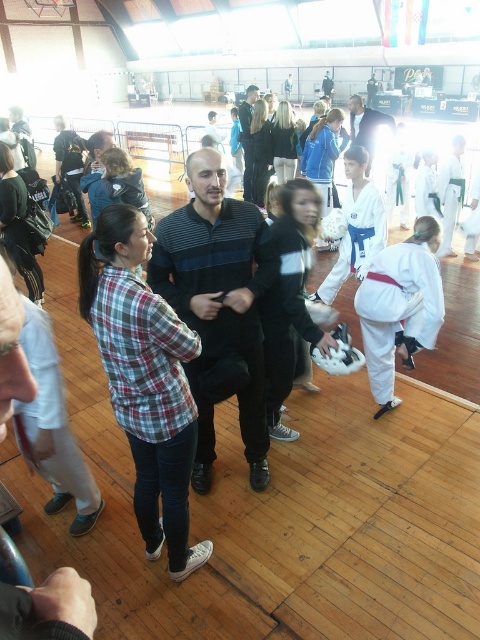
Question: Can you confirm if striped sweater at center is wider than matte black jacket at center?

Choices:
 (A) yes
 (B) no

Answer: (B)

Question: Can you confirm if striped sweater at center is positioned to the left of dark blue striped sweater at center?

Choices:
 (A) yes
 (B) no

Answer: (A)

Question: Can you confirm if striped sweater at center is positioned below dark blue striped sweater at center?

Choices:
 (A) yes
 (B) no

Answer: (A)

Question: Which object is farther from the camera taking this photo?

Choices:
 (A) striped sweater at center
 (B) matte black jacket at center
 (C) dark blue striped sweater at center

Answer: (C)

Question: Based on their relative distances, which object is nearer to the dark blue striped sweater at center?

Choices:
 (A) striped sweater at center
 (B) matte black jacket at center

Answer: (B)

Question: Which object is positioned farthest from the matte black jacket at center?

Choices:
 (A) striped sweater at center
 (B) dark blue striped sweater at center

Answer: (A)